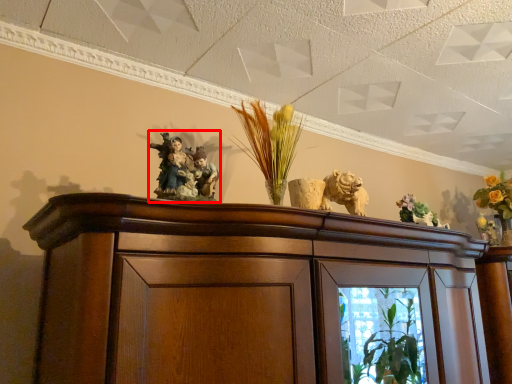
Question: In this image, where is collection (annotated by the red box) located relative to floral arrangement?

Choices:
 (A) right
 (B) left

Answer: (B)